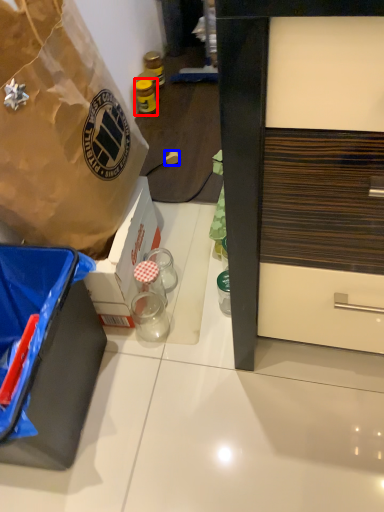
Question: Which of the following is the closest to the observer, bottle (highlighted by a red box) or power outlet (highlighted by a blue box)?

Choices:
 (A) bottle
 (B) power outlet

Answer: (B)